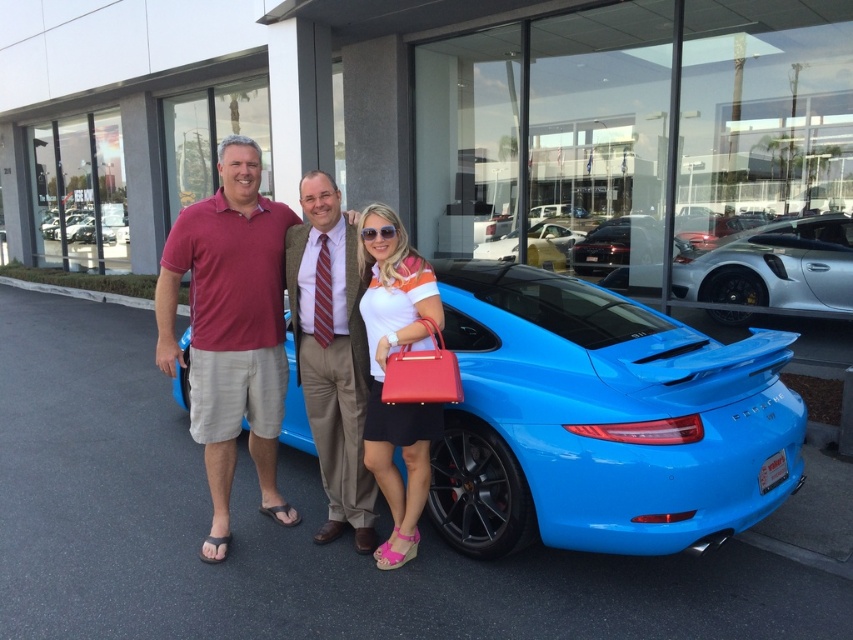
Who is positioned more to the right, matte orange shirt at center or glossy metallic car at center?

From the viewer's perspective, glossy metallic car at center appears more on the right side.

Between matte orange shirt at center and glossy metallic car at center, which one has less height?

With less height is glossy metallic car at center.

Which is in front, point (373, 289) or point (576, 252)?

Positioned in front is point (373, 289).

The height and width of the screenshot is (640, 853). Find the location of `matte orange shirt at center`. matte orange shirt at center is located at coordinates (384, 372).

Does shiny blue car at center appear on the right side of shiny white car at center?

No, shiny blue car at center is not to the right of shiny white car at center.

Between shiny blue car at center and shiny white car at center, which one has less height?

Standing shorter between the two is shiny white car at center.

Between point (447, 444) and point (677, 273), which one is positioned in front?

Point (447, 444) is in front.

Find the location of a particular element. The image size is (853, 640). shiny blue car at center is located at coordinates (602, 420).

Can you confirm if striped tie at center is positioned to the right of glossy blue sports car at center?

In fact, striped tie at center is to the left of glossy blue sports car at center.

Consider the image. Does striped tie at center have a lesser width compared to glossy blue sports car at center?

Yes, striped tie at center is thinner than glossy blue sports car at center.

Describe the element at coordinates (331, 355) in the screenshot. Image resolution: width=853 pixels, height=640 pixels. I see `striped tie at center` at that location.

In order to click on striped tie at center in this screenshot , I will do `click(331, 355)`.